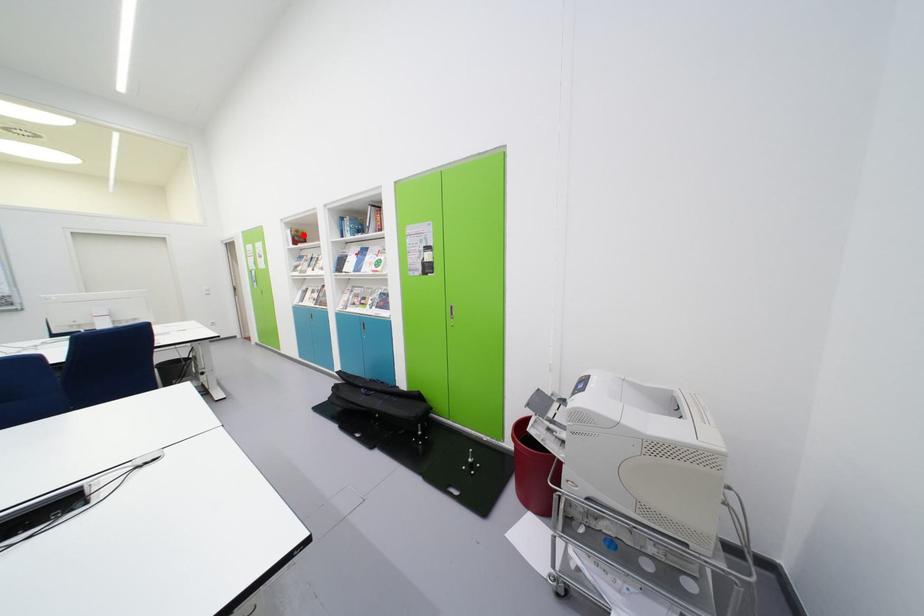
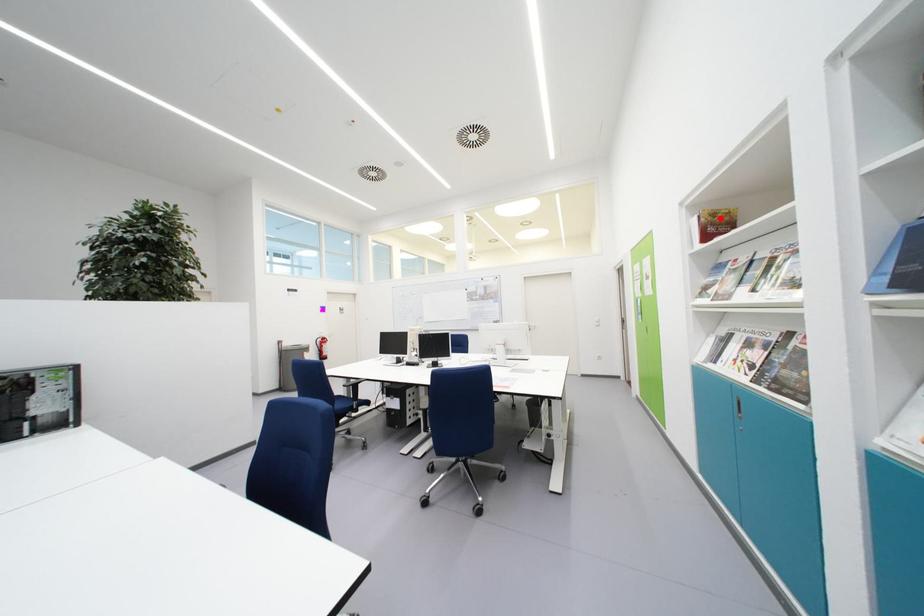
I am providing you with two images of the same scene from different viewpoints. A red point is marked on the first image and another point is marked on the second image. Are the points marked in image1 and image2 representing the same 3D position?

Yes